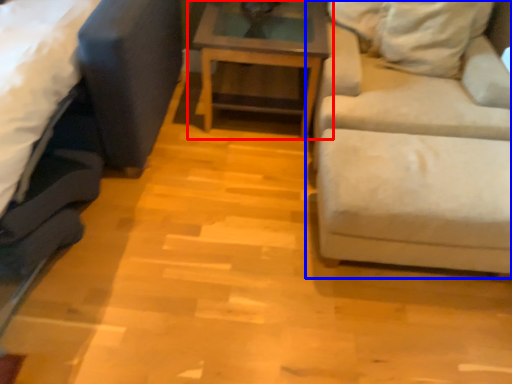
Question: Among these objects, which one is nearest to the camera, table (highlighted by a red box) or studio couch (highlighted by a blue box)?

Choices:
 (A) table
 (B) studio couch

Answer: (B)